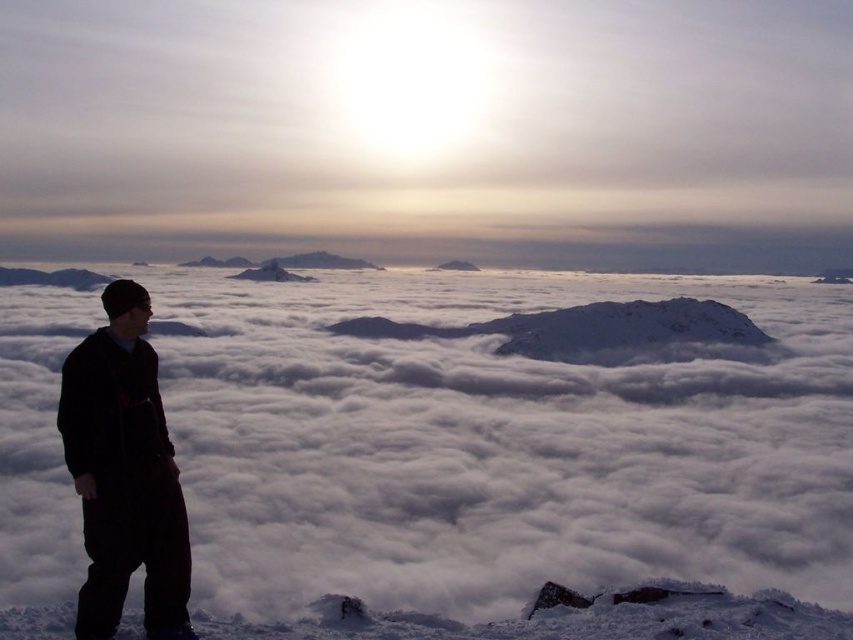
Is white matte snow at left above dark gray fleece jacket at left?

Correct, white matte snow at left is located above dark gray fleece jacket at left.

Who is taller, white matte snow at left or dark gray fleece jacket at left?

white matte snow at left

Who is more distant from viewer, (x=727, y=557) or (x=107, y=595)?

The point (x=727, y=557) is behind.

Locate an element on the screen. The width and height of the screenshot is (853, 640). white matte snow at left is located at coordinates (497, 444).

Is point (785, 515) behind point (143, 42)?

No, (785, 515) is closer to viewer.

Which of these two, white matte snow at left or white fluffy cloud at upper center, stands shorter?

white matte snow at left

Find the location of `white matte snow at left`. white matte snow at left is located at coordinates (497, 444).

Is point (509, 253) closer to camera compared to point (109, 305)?

No, it is not.

Identify the location of white fluffy cloud at upper center. (428, 131).

Is point (724, 86) farther from camera compared to point (113, 372)?

Yes, point (724, 86) is farther from viewer.

The image size is (853, 640). Identify the location of white fluffy cloud at upper center. (428, 131).